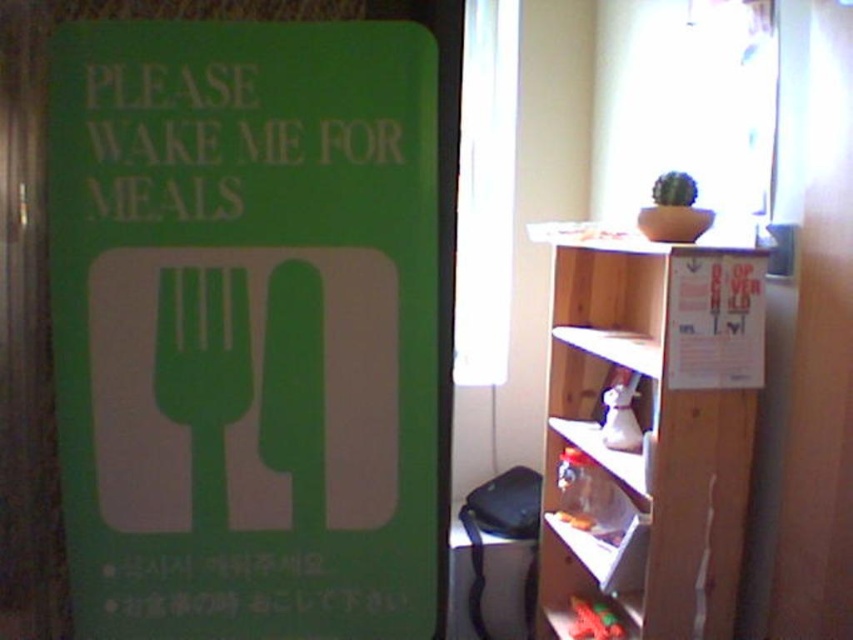
Question: Estimate the real-world distances between objects in this image. Which object is closer to the green matte sign at upper left?

Choices:
 (A) green matte sign at left
 (B) green matte fork at left

Answer: (A)

Question: Is green matte sign at left further to camera compared to green matte sign at upper left?

Choices:
 (A) yes
 (B) no

Answer: (B)

Question: Does green matte sign at left appear on the left side of green matte sign at upper left?

Choices:
 (A) yes
 (B) no

Answer: (A)

Question: Which object is closer to the camera taking this photo?

Choices:
 (A) green matte fork at left
 (B) green matte sign at upper left

Answer: (B)

Question: Which object is positioned closest to the green matte fork at left?

Choices:
 (A) green matte sign at left
 (B) green matte sign at upper left

Answer: (A)

Question: Does green matte sign at upper left appear over green matte fork at left?

Choices:
 (A) yes
 (B) no

Answer: (A)